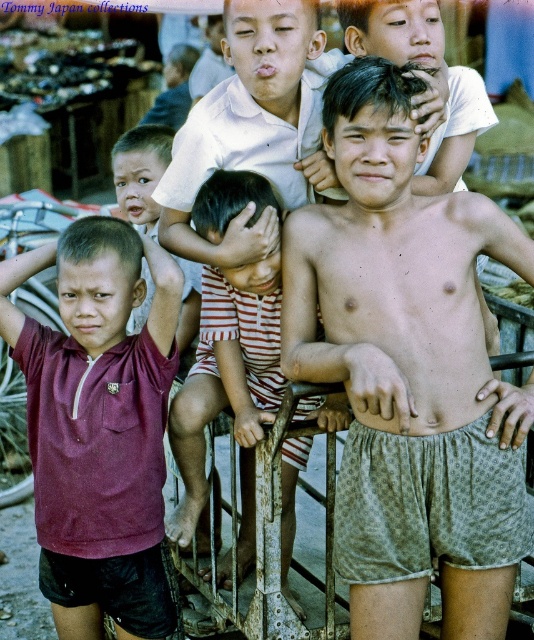
Question: Can you confirm if maroon jersey at left is wider than striped cotton romper at center?

Choices:
 (A) no
 (B) yes

Answer: (B)

Question: Estimate the real-world distances between objects in this image. Which object is farther from the maroon jersey at left?

Choices:
 (A) patterned cotton shorts at center
 (B) striped cotton romper at center

Answer: (A)

Question: Which point is farther to the camera?

Choices:
 (A) (258, 440)
 (B) (417, 456)
 (C) (115, 236)

Answer: (A)

Question: Does patterned cotton shorts at center appear on the left side of maroon jersey at left?

Choices:
 (A) no
 (B) yes

Answer: (A)

Question: Is patterned cotton shorts at center further to camera compared to maroon jersey at left?

Choices:
 (A) no
 (B) yes

Answer: (A)

Question: Which point is closer to the camera taking this photo?

Choices:
 (A) (376, 513)
 (B) (225, 298)

Answer: (A)